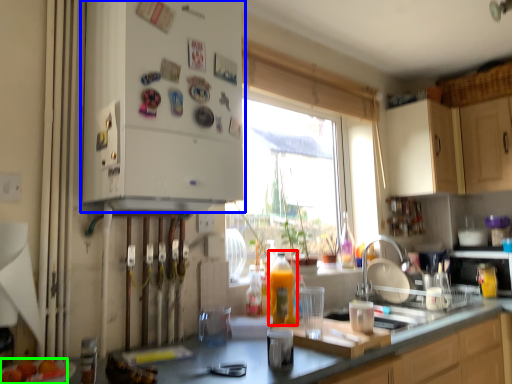
Question: Considering the real-world distances, which object is farthest from bottle (highlighted by a red box)? cabinetry (highlighted by a blue box) or food (highlighted by a green box)?

Choices:
 (A) cabinetry
 (B) food

Answer: (B)